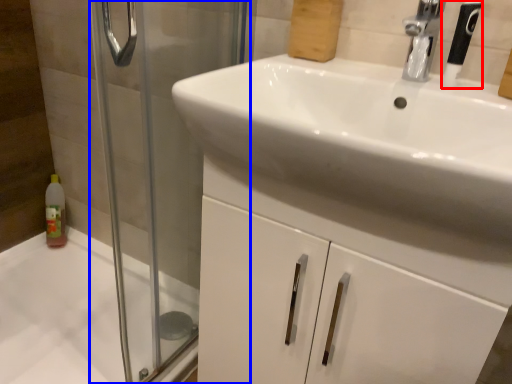
Question: Which of the following is the farthest to the observer, shower (highlighted by a red box) or screen door (highlighted by a blue box)?

Choices:
 (A) shower
 (B) screen door

Answer: (A)